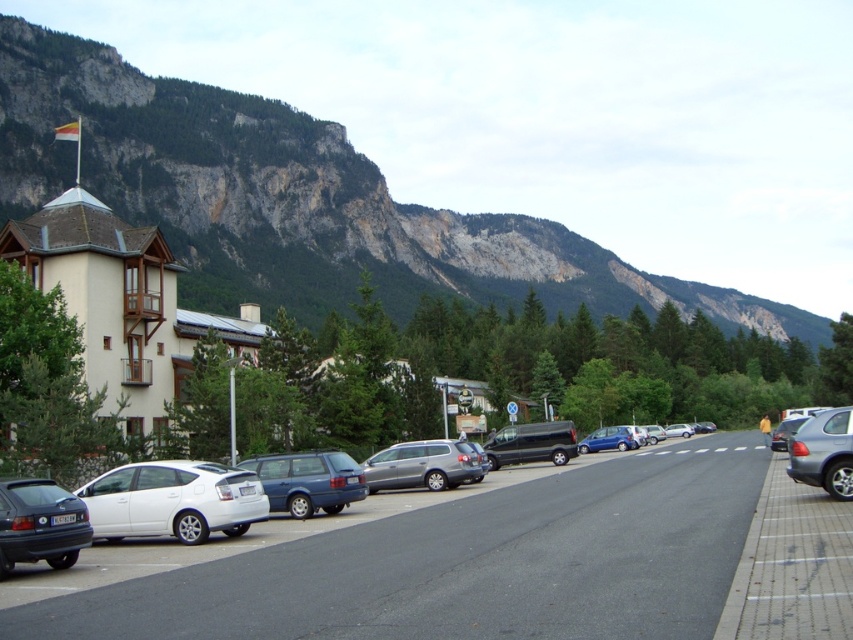
Who is more forward, (326, 493) or (440, 442)?

Positioned in front is point (326, 493).

Between point (259, 460) and point (421, 460), which one is positioned behind?

Positioned behind is point (421, 460).

The image size is (853, 640). Identify the location of matte blue station wagon at center. (308, 481).

Describe the element at coordinates (39, 524) in the screenshot. This screenshot has height=640, width=853. I see `matte black car at lower left` at that location.

Does matte black car at lower left appear under satin silver station wagon at center?

Incorrect, matte black car at lower left is not positioned below satin silver station wagon at center.

Is point (28, 552) less distant than point (405, 468)?

Yes, it is.

Identify the location of matte black car at lower left. (39, 524).

Which is behind, point (183, 131) or point (851, 464)?

The point (183, 131) is behind.

Who is lower down, rocky cliff at upper center or silver metallic suv at right?

silver metallic suv at right is below.

Is point (326, 172) less distant than point (793, 476)?

No, it is behind (793, 476).

Where is `rocky cliff at upper center`? This screenshot has height=640, width=853. rocky cliff at upper center is located at coordinates (294, 198).